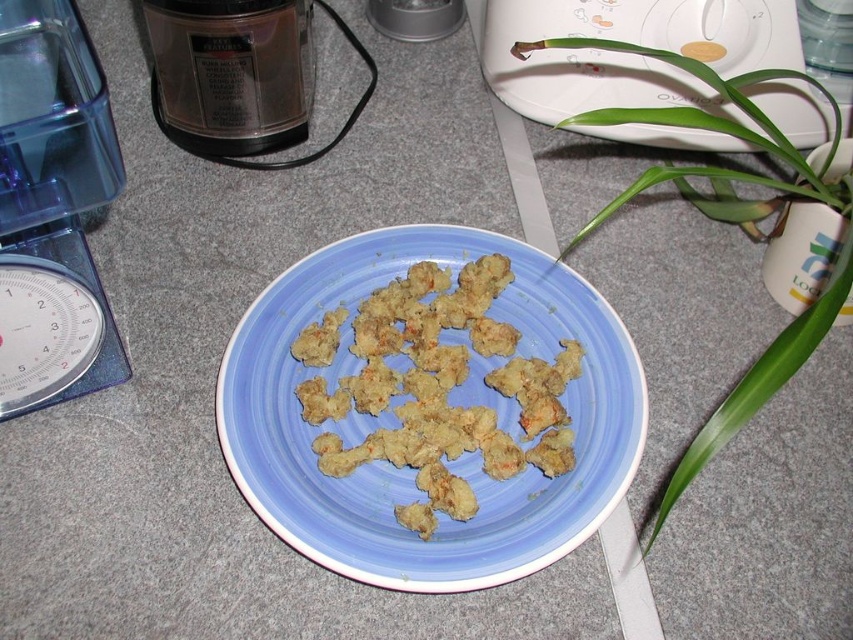
Can you confirm if golden crispy nuggets at center is positioned below white plastic toaster at upper center?

Yes.

Is golden crispy nuggets at center smaller than white plastic toaster at upper center?

Yes.

Is point (553, 444) positioned in front of point (718, 10)?

Yes, point (553, 444) is in front of point (718, 10).

Find the location of a particular element. The height and width of the screenshot is (640, 853). golden crispy nuggets at center is located at coordinates (444, 388).

Which is more to the left, transparent plastic scale at left or green leafy plant at upper right?

transparent plastic scale at left is more to the left.

Describe the element at coordinates (51, 209) in the screenshot. Image resolution: width=853 pixels, height=640 pixels. I see `transparent plastic scale at left` at that location.

The height and width of the screenshot is (640, 853). I want to click on transparent plastic scale at left, so click(51, 209).

Can you confirm if green leafy plant at upper right is positioned to the right of metallic silver toaster at upper center?

Indeed, green leafy plant at upper right is positioned on the right side of metallic silver toaster at upper center.

Who is more forward, (801, 156) or (457, 13)?

Point (801, 156)

Which is behind, point (752, 413) or point (408, 32)?

The point (408, 32) is behind.

Locate an element on the screen. green leafy plant at upper right is located at coordinates (730, 224).